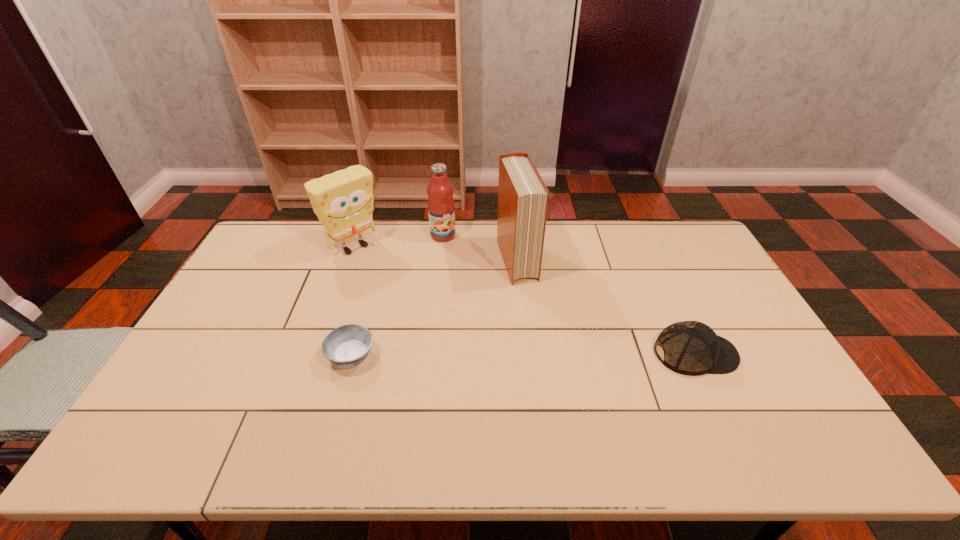
Identify the location of free spot between the cap and the tallest object. (606, 307).

The image size is (960, 540). Find the location of `free space between the fruit juice and the tallest object`. free space between the fruit juice and the tallest object is located at coordinates (480, 248).

Locate an element on the screen. The height and width of the screenshot is (540, 960). empty location between the shortest object and the fourth object from left to right is located at coordinates (434, 308).

Where is `empty location between the sponge and the ashtray`? Image resolution: width=960 pixels, height=540 pixels. empty location between the sponge and the ashtray is located at coordinates (353, 302).

You are a GUI agent. You are given a task and a screenshot of the screen. Output one action in this format:
    pyautogui.click(x=<x>, y=<y>)
    Task: Click on the vacant space that is in between the third object from left to right and the sponge
    
    Given the screenshot: What is the action you would take?
    pyautogui.click(x=398, y=241)

The width and height of the screenshot is (960, 540). What are the coordinates of `free space between the sponge and the cap` in the screenshot? It's located at (525, 300).

Identify the location of free space between the ashtray and the rightmost object. (523, 355).

Locate an element on the screen. free space between the fourth object from left to right and the second shortest object is located at coordinates (606, 307).

This screenshot has height=540, width=960. In order to click on free area in between the cap and the shortest object in this screenshot , I will do `click(523, 355)`.

Locate an element on the screen. object that is the third closest to the fourth tallest object is located at coordinates (347, 346).